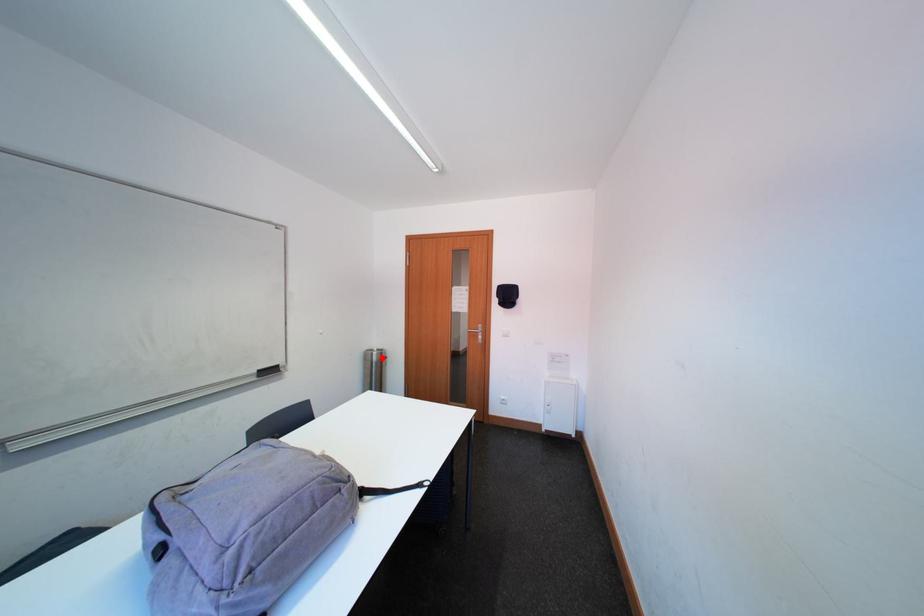
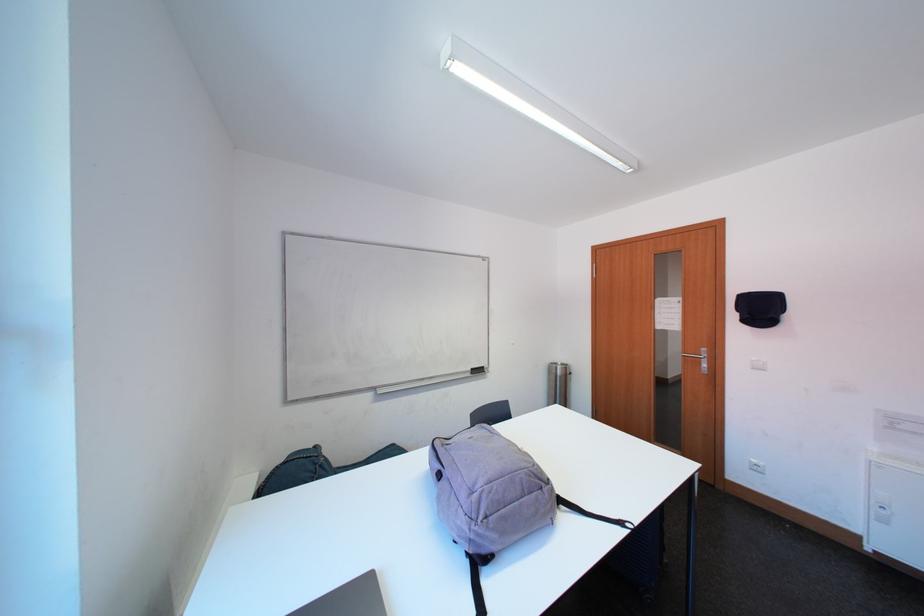
Question: I am providing you with two images of the same scene from different viewpoints. Image1 has a red point marked. In image2, the corresponding 3D location appears at what relative position? Reply with the corresponding letter.

Choices:
 (A) Closer
 (B) Farther

Answer: (A)